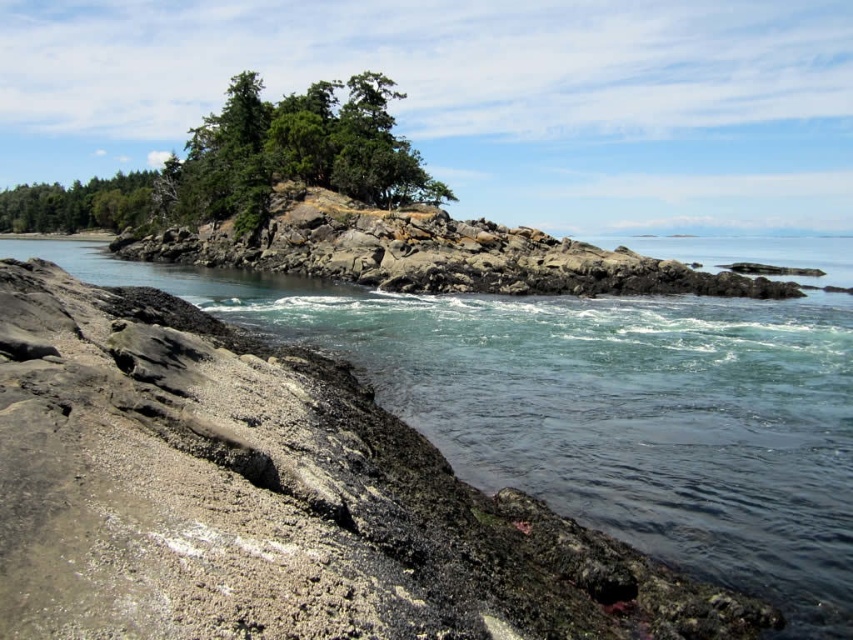
Question: Which point is farther to the camera?

Choices:
 (A) (410, 154)
 (B) (415, 243)

Answer: (A)

Question: Does green textured rock at upper center appear over green matte tree at upper left?

Choices:
 (A) yes
 (B) no

Answer: (B)

Question: Does rough granite rock at center have a smaller size compared to green matte tree at upper left?

Choices:
 (A) no
 (B) yes

Answer: (B)

Question: Which point is farther to the camera?

Choices:
 (A) clear water at center
 (B) green textured rock at upper center

Answer: (B)

Question: Does rough granite rock at center appear over green textured rock at upper center?

Choices:
 (A) yes
 (B) no

Answer: (B)

Question: Which is farther from the green textured rock at upper center?

Choices:
 (A) green matte tree at upper left
 (B) rough granite rock at center

Answer: (A)